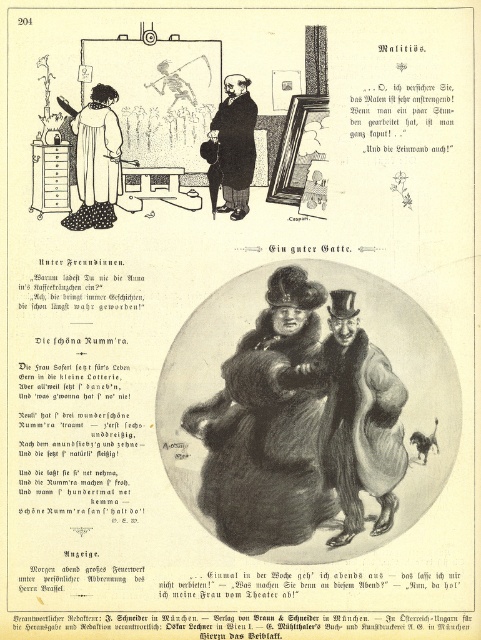
Is smooth fur coat at center shorter than fluffy white robe at upper left?

In fact, smooth fur coat at center may be taller than fluffy white robe at upper left.

From the picture: Between smooth fur coat at center and fluffy white robe at upper left, which one appears on the right side from the viewer's perspective?

From the viewer's perspective, smooth fur coat at center appears more on the right side.

Who is more forward, (368, 488) or (97, 96)?

Point (368, 488)

Image resolution: width=481 pixels, height=640 pixels. Identify the location of smooth fur coat at center. (359, 420).

Does fuzzy fur coat at center appear on the left side of fluffy white robe at upper left?

Incorrect, fuzzy fur coat at center is not on the left side of fluffy white robe at upper left.

Between point (308, 336) and point (85, 132), which one is positioned in front?

Point (308, 336) is in front.

Find the location of `fuzzy fur coat at center`. fuzzy fur coat at center is located at coordinates (306, 412).

The width and height of the screenshot is (481, 640). What do you see at coordinates (97, 161) in the screenshot? I see `fluffy white robe at upper left` at bounding box center [97, 161].

Is point (111, 132) farther from camera compared to point (223, 113)?

Yes, it is behind point (223, 113).

Find the location of a particular element. The image size is (481, 640). fluffy white robe at upper left is located at coordinates (97, 161).